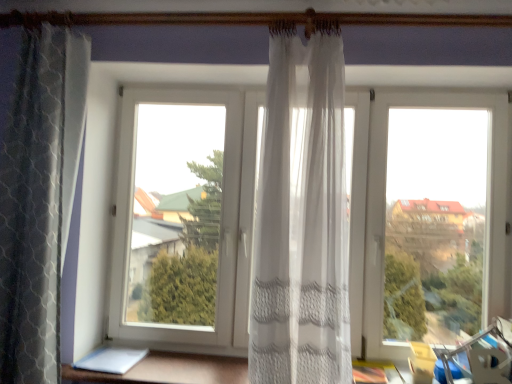
Question: Is white sheer curtain at lower center inside or outside of textured gray curtain at left, arranged as the 1th curtain when viewed from the left?

Choices:
 (A) outside
 (B) inside

Answer: (A)

Question: In terms of size, does white sheer curtain at lower center appear bigger or smaller than textured gray curtain at left, arranged as the 1th curtain when viewed from the left?

Choices:
 (A) small
 (B) big

Answer: (A)

Question: Estimate the real-world distances between objects in this image. Which object is closer to the textured gray curtain at left, arranged as the second curtain when viewed from the right?

Choices:
 (A) white sheer curtain at lower center
 (B) sheer white curtain at center, which ranks as the 2th curtain in left-to-right order
 (C) transparent plastic window at center

Answer: (A)

Question: Considering the real-world distances, which object is closest to the white sheer curtain at lower center?

Choices:
 (A) sheer white curtain at center, which ranks as the 2th curtain in left-to-right order
 (B) textured gray curtain at left, arranged as the second curtain when viewed from the right
 (C) transparent plastic window at center

Answer: (B)